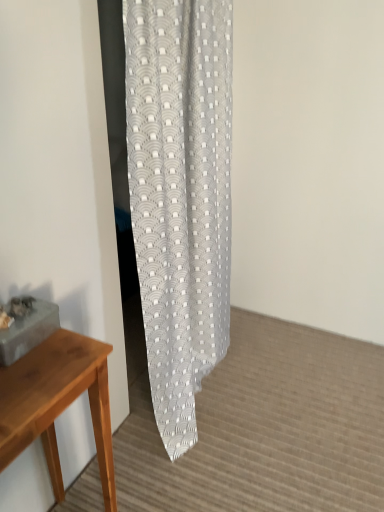
You are a GUI agent. You are given a task and a screenshot of the screen. Output one action in this format:
    pyautogui.click(x=<x>, y=<y>)
    Task: Click on the empty space that is ontop of wooden table at left (from a real-world perspective)
    The height and width of the screenshot is (512, 384).
    Given the screenshot: What is the action you would take?
    pyautogui.click(x=36, y=367)